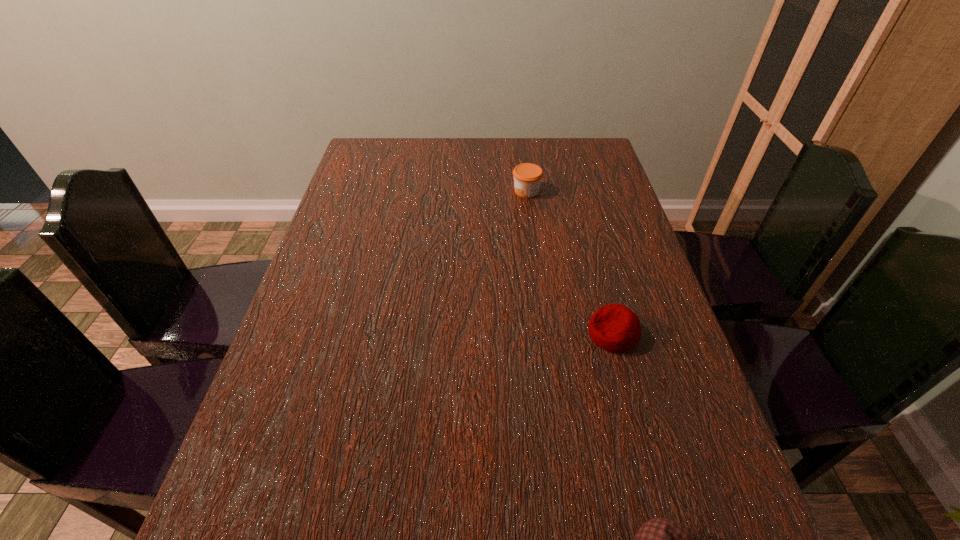
Find the location of a particular element. jam is located at coordinates (527, 177).

Find the location of a particular element. The height and width of the screenshot is (540, 960). the farthest object is located at coordinates (527, 177).

Image resolution: width=960 pixels, height=540 pixels. I want to click on the second farthest object, so click(615, 328).

What are the coordinates of `blank area located on the front label of the jam` in the screenshot? It's located at (443, 191).

Where is `vacant space located 0.260m on the front label of the jam`? vacant space located 0.260m on the front label of the jam is located at coordinates (425, 191).

I want to click on vacant area situated 0.160m on the front label of the jam, so click(459, 191).

Identify the location of vacant space located on the seat area of the second farthest object. (500, 334).

Find the location of a particular element. free spot located 0.250m on the seat area of the second farthest object is located at coordinates (472, 334).

Find the location of a particular element. This screenshot has height=540, width=960. vacant space located on the seat area of the second farthest object is located at coordinates (528, 334).

This screenshot has height=540, width=960. I want to click on object present at the right edge, so (615, 328).